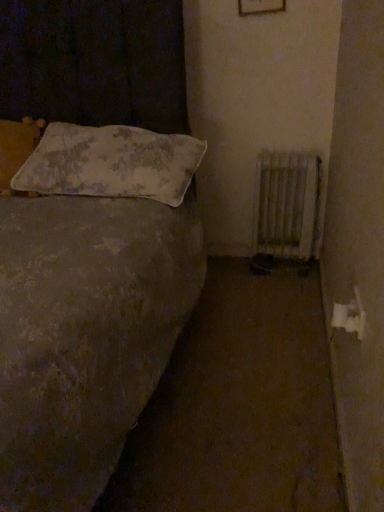
Question: Does white metallic radiator at lower right have a lesser width compared to fluffy white pillow at upper left, which ranks as the 1th pillow in left-to-right order?

Choices:
 (A) no
 (B) yes

Answer: (B)

Question: Does white metallic radiator at lower right have a greater height compared to fluffy white pillow at upper left, which ranks as the 1th pillow in left-to-right order?

Choices:
 (A) no
 (B) yes

Answer: (B)

Question: Is white metallic radiator at lower right next to fluffy white pillow at upper left, which appears as the second pillow when viewed from the right, and touching it?

Choices:
 (A) yes
 (B) no

Answer: (B)

Question: Is white metallic radiator at lower right at the right side of fluffy white pillow at upper left, which ranks as the 1th pillow in left-to-right order?

Choices:
 (A) no
 (B) yes

Answer: (B)

Question: Considering the relative sizes of white metallic radiator at lower right and fluffy white pillow at upper left, which ranks as the 1th pillow in left-to-right order, in the image provided, is white metallic radiator at lower right bigger than fluffy white pillow at upper left, which ranks as the 1th pillow in left-to-right order,?

Choices:
 (A) yes
 (B) no

Answer: (B)

Question: Does point (16, 139) appear closer or farther from the camera than point (198, 162)?

Choices:
 (A) closer
 (B) farther

Answer: (B)

Question: Is fluffy white pillow at upper left, which ranks as the 1th pillow in left-to-right order, in front of or behind fluffy white pillow at upper left, positioned as the 1th pillow in right-to-left order, in the image?

Choices:
 (A) behind
 (B) front

Answer: (A)

Question: Considering the relative positions of fluffy white pillow at upper left, which appears as the second pillow when viewed from the right, and fluffy white pillow at upper left, positioned as the 1th pillow in right-to-left order, in the image provided, is fluffy white pillow at upper left, which appears as the second pillow when viewed from the right, to the left or to the right of fluffy white pillow at upper left, positioned as the 1th pillow in right-to-left order,?

Choices:
 (A) right
 (B) left

Answer: (B)

Question: From the image's perspective, is fluffy white pillow at upper left, which ranks as the 1th pillow in left-to-right order, positioned above or below fluffy white pillow at upper left, which ranks as the 2th pillow in left-to-right order?

Choices:
 (A) below
 (B) above

Answer: (B)

Question: From their relative heights in the image, would you say white metallic radiator at lower right is taller or shorter than fluffy white pillow at upper left, which ranks as the 2th pillow in left-to-right order?

Choices:
 (A) tall
 (B) short

Answer: (A)

Question: In terms of width, does white metallic radiator at lower right look wider or thinner when compared to fluffy white pillow at upper left, positioned as the 1th pillow in right-to-left order?

Choices:
 (A) thin
 (B) wide

Answer: (A)

Question: Based on their positions, is white metallic radiator at lower right located to the left or right of fluffy white pillow at upper left, which ranks as the 2th pillow in left-to-right order?

Choices:
 (A) right
 (B) left

Answer: (A)

Question: Is white metallic radiator at lower right bigger or smaller than fluffy white pillow at upper left, which ranks as the 2th pillow in left-to-right order?

Choices:
 (A) big
 (B) small

Answer: (B)

Question: Which is correct: fluffy white pillow at upper left, positioned as the 1th pillow in right-to-left order, is inside white metallic radiator at lower right, or outside of it?

Choices:
 (A) inside
 (B) outside

Answer: (B)

Question: From a real-world perspective, is fluffy white pillow at upper left, positioned as the 1th pillow in right-to-left order, positioned above or below white metallic radiator at lower right?

Choices:
 (A) below
 (B) above

Answer: (B)